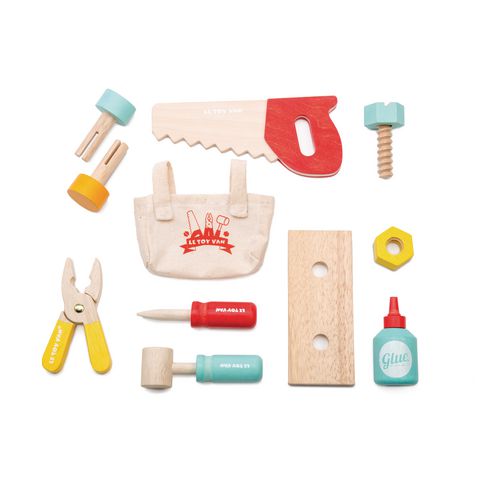
Identify the location of glue bottle. The image size is (480, 480). (406, 348).